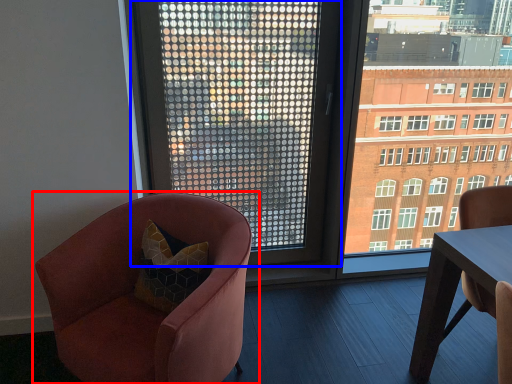
Question: Which of the following is the closest to the observer, chair (highlighted by a red box) or window (highlighted by a blue box)?

Choices:
 (A) chair
 (B) window

Answer: (A)